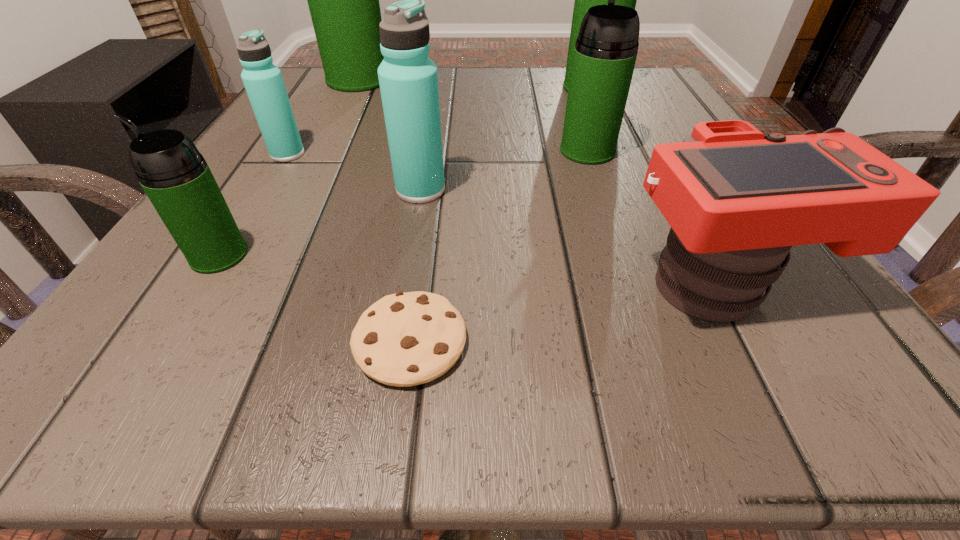
Where is `object that is at the near right corner`? object that is at the near right corner is located at coordinates (737, 200).

Find the location of a particular element. This screenshot has width=960, height=540. blank area at the far edge is located at coordinates (504, 103).

The image size is (960, 540). I want to click on free space at the near edge of the desktop, so click(x=667, y=337).

You are a GUI agent. You are given a task and a screenshot of the screen. Output one action in this format:
    pyautogui.click(x=<x>, y=<y>)
    Task: Click on the free space at the left edge
    The height and width of the screenshot is (540, 960).
    Given the screenshot: What is the action you would take?
    pyautogui.click(x=345, y=118)

The width and height of the screenshot is (960, 540). In the image, there is a desktop. What are the coordinates of `vacant area at the right edge` in the screenshot? It's located at (636, 192).

Image resolution: width=960 pixels, height=540 pixels. In the image, there is a desktop. Find the location of `vacant space at the far left corner`. vacant space at the far left corner is located at coordinates (305, 97).

This screenshot has height=540, width=960. Find the location of `blank space at the near right corner of the desktop`. blank space at the near right corner of the desktop is located at coordinates (779, 366).

Find the location of a particular element. The height and width of the screenshot is (540, 960). empty location between the nearest green thermos bottle and the left aqua thermos bottle is located at coordinates 253,205.

The height and width of the screenshot is (540, 960). In order to click on unoccupied area between the shortest object and the camera in this screenshot , I will do `click(564, 311)`.

Identify the location of unoccupied area between the tallest object and the camera. The height and width of the screenshot is (540, 960). click(x=539, y=180).